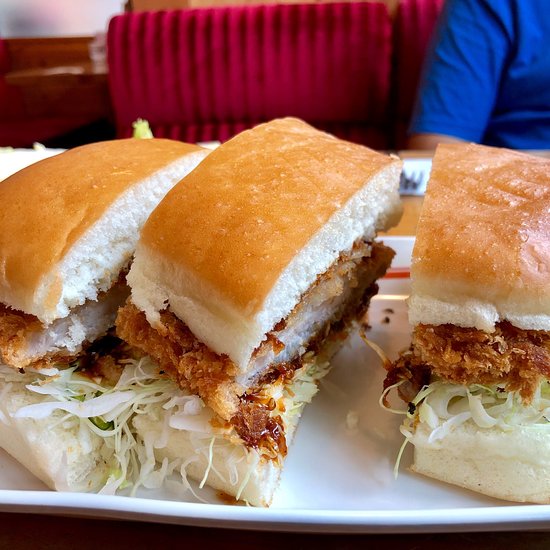
This screenshot has width=550, height=550. I want to click on silverware handle, so click(421, 179), click(414, 172).